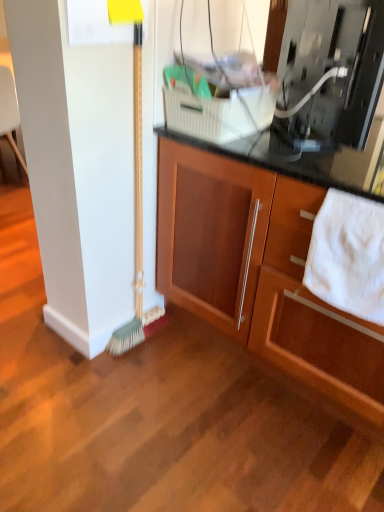
Question: Does white soft towel at lower right have a lesser height compared to wooden cabinet at center?

Choices:
 (A) yes
 (B) no

Answer: (A)

Question: Does white soft towel at lower right lie behind wooden cabinet at center?

Choices:
 (A) no
 (B) yes

Answer: (B)

Question: Would you say wooden cabinet at center is part of white soft towel at lower right's contents?

Choices:
 (A) no
 (B) yes

Answer: (A)

Question: Considering the relative positions of white soft towel at lower right and wooden cabinet at center in the image provided, is white soft towel at lower right in front of wooden cabinet at center?

Choices:
 (A) yes
 (B) no

Answer: (B)

Question: From the image's perspective, is white soft towel at lower right beneath wooden cabinet at center?

Choices:
 (A) yes
 (B) no

Answer: (A)

Question: Is white soft towel at lower right at the right side of wooden cabinet at center?

Choices:
 (A) no
 (B) yes

Answer: (A)

Question: From the image's perspective, is wooden cabinet at center on top of green bristle broom at left?

Choices:
 (A) yes
 (B) no

Answer: (B)

Question: From a real-world perspective, does wooden cabinet at center sit lower than green bristle broom at left?

Choices:
 (A) no
 (B) yes

Answer: (B)

Question: Considering the relative sizes of wooden cabinet at center and green bristle broom at left in the image provided, is wooden cabinet at center taller than green bristle broom at left?

Choices:
 (A) yes
 (B) no

Answer: (B)

Question: Is wooden cabinet at center not near green bristle broom at left?

Choices:
 (A) yes
 (B) no

Answer: (B)

Question: Does wooden cabinet at center have a lesser height compared to green bristle broom at left?

Choices:
 (A) yes
 (B) no

Answer: (A)

Question: Considering the relative sizes of wooden cabinet at center and green bristle broom at left in the image provided, is wooden cabinet at center thinner than green bristle broom at left?

Choices:
 (A) no
 (B) yes

Answer: (A)

Question: Is wooden cabinet at center turned away from metallic silver microwave at upper right?

Choices:
 (A) no
 (B) yes

Answer: (A)